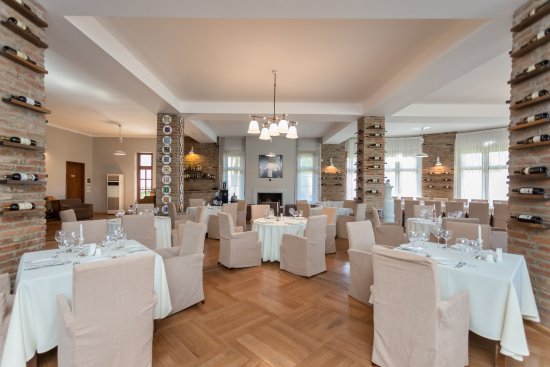
You are a GUI agent. You are given a task and a screenshot of the screen. Output one action in this format:
    pyautogui.click(x=<x>, y=<y>)
    Task: Click on the tables
    
    Given the screenshot: What is the action you would take?
    pyautogui.click(x=55, y=281), pyautogui.click(x=270, y=226), pyautogui.click(x=484, y=263), pyautogui.click(x=338, y=206)